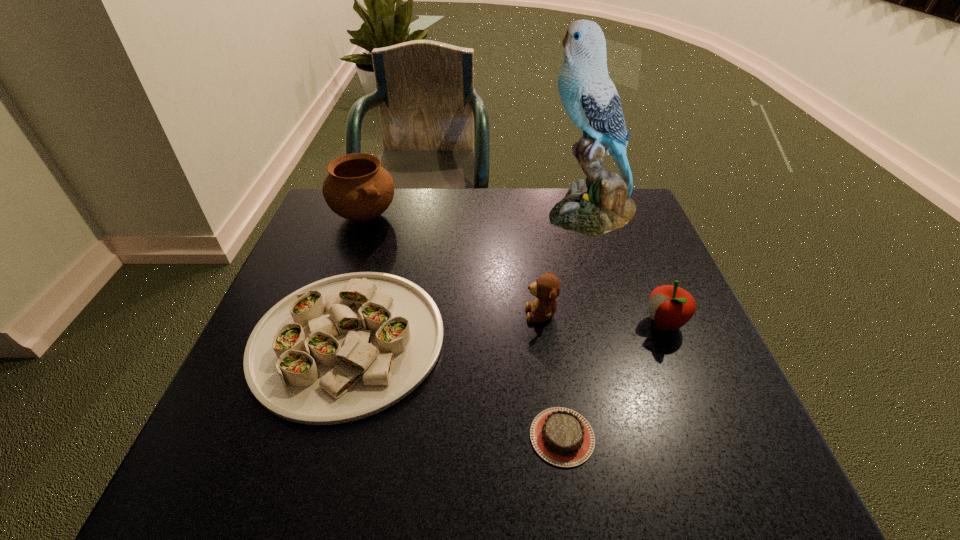
The height and width of the screenshot is (540, 960). I want to click on object that stands as the second closest to the second tallest object, so click(x=589, y=96).

Identify which object is the fourth closest to the second tallest object. Please provide its 2D coordinates. Your answer should be formatted as a tuple, i.e. [(x, y)], where the tuple contains the x and y coordinates of a point satisfying the conditions above.

[(561, 436)]

Locate an element on the screen. This screenshot has height=540, width=960. vacant space that satisfies the following two spatial constraints: 1. on the face of the parakeet; 2. on the front side of the platter is located at coordinates (632, 340).

Locate an element on the screen. The image size is (960, 540). vacant space that satisfies the following two spatial constraints: 1. on the face of the teddy bear; 2. on the right side of the apple is located at coordinates (542, 323).

You are a GUI agent. You are given a task and a screenshot of the screen. Output one action in this format:
    pyautogui.click(x=<x>, y=<y>)
    Task: Click on the vacant region that satisfies the following two spatial constraints: 1. on the face of the teddy bear; 2. on the left side of the chocolate cake
    The width and height of the screenshot is (960, 540).
    Given the screenshot: What is the action you would take?
    pyautogui.click(x=558, y=437)

Locate an element on the screen. This screenshot has width=960, height=540. vacant area in the image that satisfies the following two spatial constraints: 1. on the back side of the apple; 2. on the face of the tallest object is located at coordinates (618, 213).

Where is `free location that satisfies the following two spatial constraints: 1. on the face of the teddy bear; 2. on the front side of the platter`? free location that satisfies the following two spatial constraints: 1. on the face of the teddy bear; 2. on the front side of the platter is located at coordinates (544, 340).